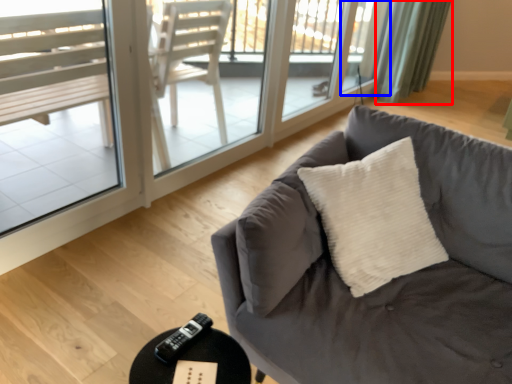
Question: Which of the following is the closest to the observer, curtain (highlighted by a red box) or window (highlighted by a blue box)?

Choices:
 (A) curtain
 (B) window

Answer: (B)